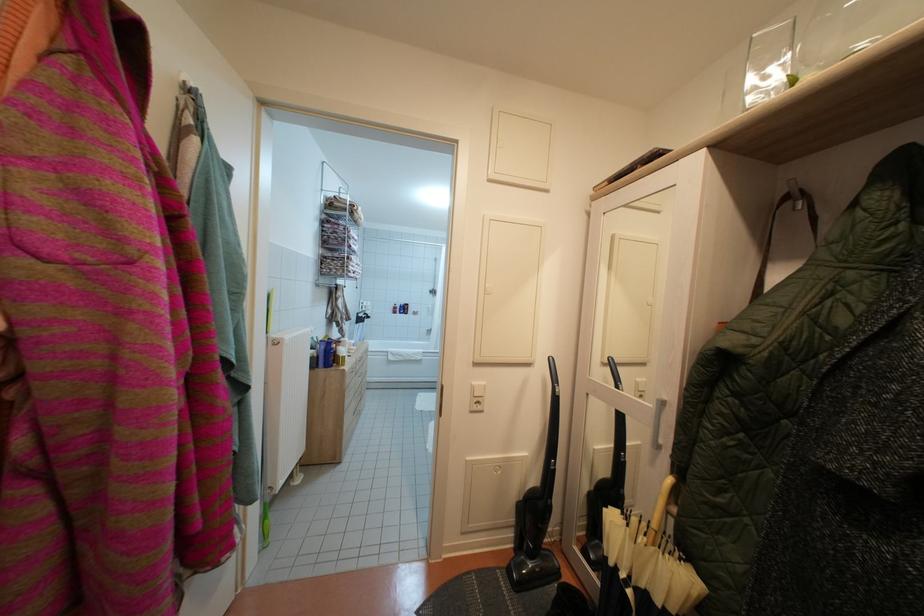
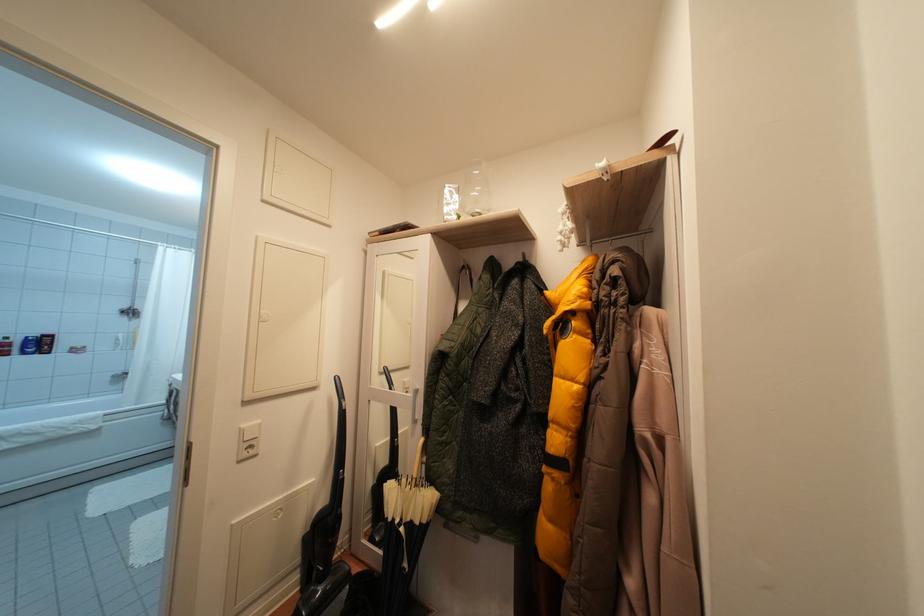
The point at (x=641, y=525) is marked in the first image. Where is the corresponding point in the second image?

(410, 485)